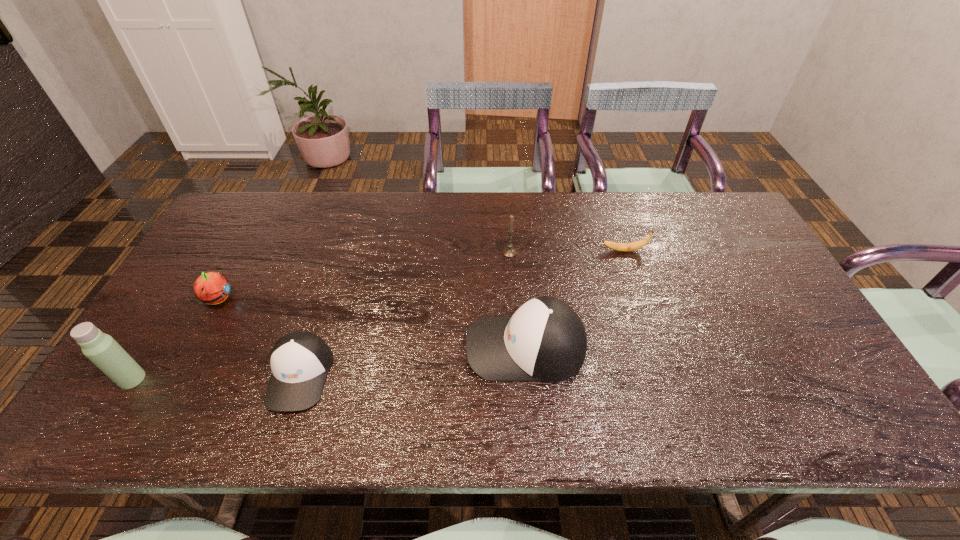
I want to click on vacant area that lies between the banana and the apple, so click(420, 275).

Locate an element on the screen. The height and width of the screenshot is (540, 960). free space between the third farthest object and the right cap is located at coordinates (372, 323).

This screenshot has width=960, height=540. I want to click on blank region between the thermos bottle and the shortest object, so click(378, 315).

The width and height of the screenshot is (960, 540). Find the location of `vacant space in between the rightmost object and the candle`. vacant space in between the rightmost object and the candle is located at coordinates (566, 252).

Identify the location of free spot between the candle and the shortest object. The width and height of the screenshot is (960, 540). (566, 252).

The width and height of the screenshot is (960, 540). I want to click on free area in between the fourth object from right to left and the rightmost object, so click(x=462, y=313).

Identify the location of vacant area that lies between the candle and the tallest object. (321, 316).

Where is `vacant space in between the shortest object and the fourth object from right to left`? vacant space in between the shortest object and the fourth object from right to left is located at coordinates (462, 313).

Locate which object ranks third in proximity to the left cap. Please provide its 2D coordinates. Your answer should be formatted as a tuple, i.e. [(x, y)], where the tuple contains the x and y coordinates of a point satisfying the conditions above.

[(545, 340)]

This screenshot has width=960, height=540. I want to click on object that stands as the fifth closest to the taller cap, so pyautogui.click(x=100, y=348).